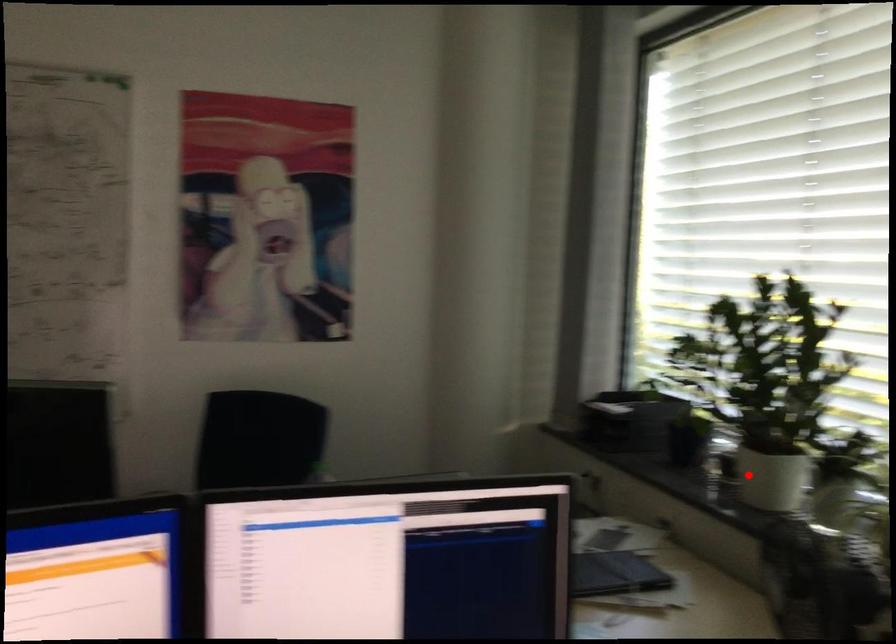
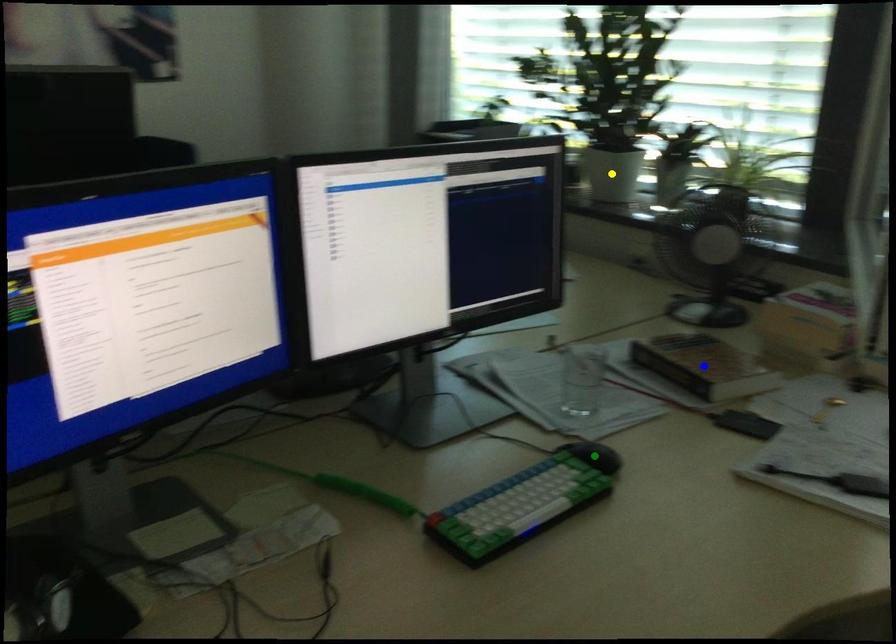
Question: I am providing you with two images of the same scene from different viewpoints. A red point is marked on the first image. You are given multiple points on the second image. Which point in image 2 represents the same 3d spot as the red point in image 1?

Choices:
 (A) blue point
 (B) yellow point
 (C) green point

Answer: (B)